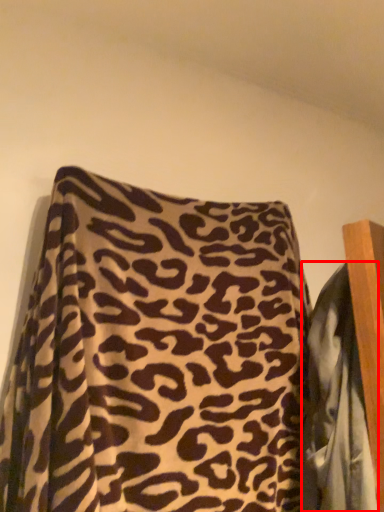
Question: Where is blanket (annotated by the red box) located in relation to pillow in the image?

Choices:
 (A) right
 (B) left

Answer: (A)